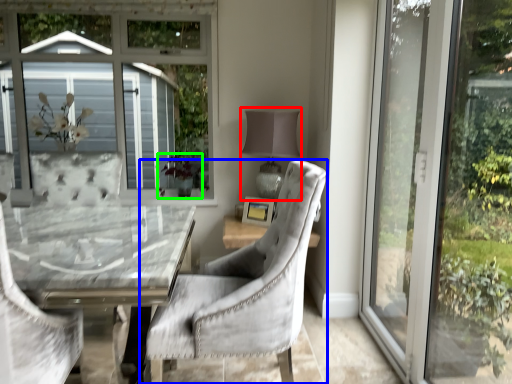
Question: Which object is the farthest from table lamp (highlighted by a red box)? Choose among these: chair (highlighted by a blue box) or plant (highlighted by a green box).

Choices:
 (A) chair
 (B) plant

Answer: (A)